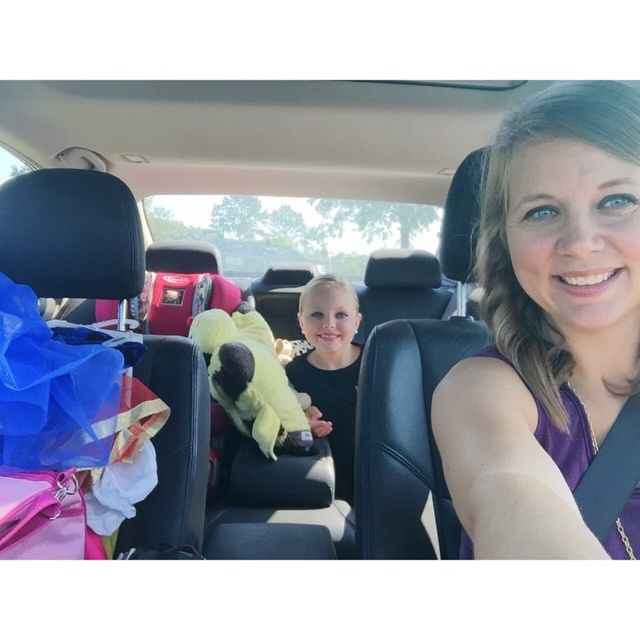
Question: Which object appears farthest from the camera in this image?

Choices:
 (A) soft yellow plush at center
 (B) purple fabric sleeveless top at center
 (C) black leather car at center

Answer: (A)

Question: Which point is farther from the camera taking this photo?

Choices:
 (A) (209, 316)
 (B) (522, 284)
 (C) (348, 499)

Answer: (C)

Question: Does black leather car at center appear on the right side of purple fabric sleeveless top at center?

Choices:
 (A) no
 (B) yes

Answer: (A)

Question: Is purple fabric sleeveless top at center smaller than soft yellow plush at center?

Choices:
 (A) yes
 (B) no

Answer: (A)

Question: Which object is farther from the camera taking this photo?

Choices:
 (A) purple fabric sleeveless top at center
 (B) black leather car at center
 (C) black matte dress at center

Answer: (C)

Question: Is soft yellow plush at center wider than black matte dress at center?

Choices:
 (A) yes
 (B) no

Answer: (A)